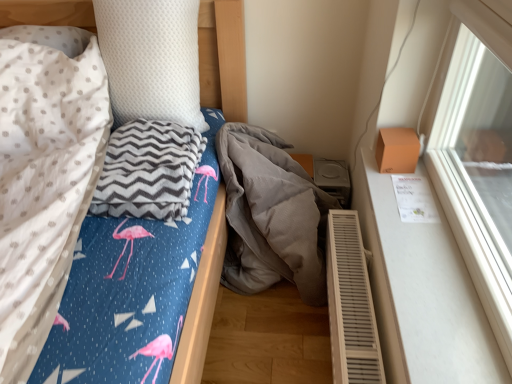
Identify the location of gray corduroy blanket at center, the 1th material viewed from the right. The height and width of the screenshot is (384, 512). (271, 215).

What do you see at coordinates (422, 291) in the screenshot? I see `white matte window sill at right` at bounding box center [422, 291].

In order to face white matte window sill at right, should I rotate leftwards or rightwards?

A 20.139 degree turn to the right will do.

You are a GUI agent. You are given a task and a screenshot of the screen. Output one action in this format:
    pyautogui.click(x=<x>, y=<y>)
    Task: Click on the white plastic air conditioner at lower right
    
    Given the screenshot: What is the action you would take?
    pyautogui.click(x=351, y=304)

Locate an element on the screen. white dotted pillow at upper left is located at coordinates (151, 59).

What do you see at coordinates (148, 171) in the screenshot? This screenshot has width=512, height=384. I see `gray chevron blanket at left, which ranks as the 1th material in left-to-right order` at bounding box center [148, 171].

Identify the location of gray corduroy blanket at center, the 1th material viewed from the right. Image resolution: width=512 pixels, height=384 pixels. (271, 215).

Which object is wider, white dotted pillow at upper left or gray corduroy blanket at center, the 1th material viewed from the right?

gray corduroy blanket at center, the 1th material viewed from the right, is wider.

From the image's perspective, who appears lower, white dotted pillow at upper left or gray corduroy blanket at center, the 1th material viewed from the right?

gray corduroy blanket at center, the 1th material viewed from the right.

Is point (138, 16) positioned behind point (297, 265)?

No, it is in front of (297, 265).

Considering the relative positions of white matte window sill at right and white plastic air conditioner at lower right in the image provided, is white matte window sill at right in front of white plastic air conditioner at lower right?

Yes.

Are white matte window sill at right and white plastic air conditioner at lower right located far from each other?

No, white matte window sill at right is not far away from white plastic air conditioner at lower right.

Is white matte window sill at right wider or thinner than white plastic air conditioner at lower right?

Considering their sizes, white matte window sill at right looks broader than white plastic air conditioner at lower right.

Considering the sizes of white matte window sill at right and white plastic air conditioner at lower right in the image, is white matte window sill at right bigger or smaller than white plastic air conditioner at lower right?

white matte window sill at right is smaller than white plastic air conditioner at lower right.

Does gray chevron blanket at left, which is the 2th material from right to left, lie behind white dotted pillow at upper left?

No, the depth of gray chevron blanket at left, which is the 2th material from right to left, is less than that of white dotted pillow at upper left.

Consider the image. From a real-world perspective, is gray chevron blanket at left, which is the 2th material from right to left, positioned under white dotted pillow at upper left based on gravity?

Yes, from a real-world perspective, gray chevron blanket at left, which is the 2th material from right to left, is under white dotted pillow at upper left.

From the picture: Considering the sizes of gray chevron blanket at left, which ranks as the 1th material in left-to-right order, and white dotted pillow at upper left in the image, is gray chevron blanket at left, which ranks as the 1th material in left-to-right order, wider or thinner than white dotted pillow at upper left?

In the image, gray chevron blanket at left, which ranks as the 1th material in left-to-right order, appears to be wider than white dotted pillow at upper left.

Is gray chevron blanket at left, which ranks as the 1th material in left-to-right order, at the right side of white dotted pillow at upper left?

Correct, you'll find gray chevron blanket at left, which ranks as the 1th material in left-to-right order, to the right of white dotted pillow at upper left.

How many degrees apart are the facing directions of gray corduroy blanket at center, the 1th material viewed from the right, and white dotted pillow at upper left?

2.49 degrees.

Which object is more forward, gray corduroy blanket at center, which is counted as the 2th material, starting from the left, or white dotted pillow at upper left?

gray corduroy blanket at center, which is counted as the 2th material, starting from the left.

Is point (243, 215) more distant than point (147, 67)?

That is True.

Does gray corduroy blanket at center, the 1th material viewed from the right, contain white dotted pillow at upper left?

No, white dotted pillow at upper left is located outside of gray corduroy blanket at center, the 1th material viewed from the right.

From a real-world perspective, does white matte window sill at right stand above gray corduroy blanket at center, which is counted as the 2th material, starting from the left?

Yes, from a real-world perspective, white matte window sill at right is above gray corduroy blanket at center, which is counted as the 2th material, starting from the left.

Does white matte window sill at right appear on the left side of gray corduroy blanket at center, the 1th material viewed from the right?

In fact, white matte window sill at right is to the right of gray corduroy blanket at center, the 1th material viewed from the right.

Is gray corduroy blanket at center, the 1th material viewed from the right, located within white matte window sill at right?

No, gray corduroy blanket at center, the 1th material viewed from the right, is located outside of white matte window sill at right.

Locate an element on the screen. The image size is (512, 384). material located underneath the white matte window sill at right (from a real-world perspective) is located at coordinates (271, 215).

Does gray corduroy blanket at center, the 1th material viewed from the right, have a greater width compared to gray chevron blanket at left, which is the 2th material from right to left?

Yes, gray corduroy blanket at center, the 1th material viewed from the right, is wider than gray chevron blanket at left, which is the 2th material from right to left.

Can you confirm if gray corduroy blanket at center, the 1th material viewed from the right, is bigger than gray chevron blanket at left, which ranks as the 1th material in left-to-right order?

Indeed, gray corduroy blanket at center, the 1th material viewed from the right, has a larger size compared to gray chevron blanket at left, which ranks as the 1th material in left-to-right order.

Would you say gray corduroy blanket at center, the 1th material viewed from the right, is outside gray chevron blanket at left, which ranks as the 1th material in left-to-right order?

Absolutely, gray corduroy blanket at center, the 1th material viewed from the right, is external to gray chevron blanket at left, which ranks as the 1th material in left-to-right order.

Does gray chevron blanket at left, which is the 2th material from right to left, turn towards white matte window sill at right?

No, gray chevron blanket at left, which is the 2th material from right to left, is not turned towards white matte window sill at right.

Is gray chevron blanket at left, which is the 2th material from right to left, to the right of white matte window sill at right from the viewer's perspective?

Incorrect, gray chevron blanket at left, which is the 2th material from right to left, is not on the right side of white matte window sill at right.

From a real-world perspective, is gray chevron blanket at left, which ranks as the 1th material in left-to-right order, below white matte window sill at right?

No, from a real-world perspective, gray chevron blanket at left, which ranks as the 1th material in left-to-right order, is not under white matte window sill at right.

Who is shorter, gray chevron blanket at left, which is the 2th material from right to left, or white matte window sill at right?

Standing shorter between the two is white matte window sill at right.

Identify the location of pillow lying behind the gray corduroy blanket at center, which is counted as the 2th material, starting from the left. (151, 59).

The image size is (512, 384). Identify the location of window sill lying on the right of white plastic air conditioner at lower right. (422, 291).

Considering their positions, is white plastic air conditioner at lower right positioned further to white matte window sill at right than gray corduroy blanket at center, the 1th material viewed from the right?

gray corduroy blanket at center, the 1th material viewed from the right, is further to white matte window sill at right.

Which object lies nearer to the anchor point white dotted pillow at upper left, white plastic air conditioner at lower right or gray chevron blanket at left, which ranks as the 1th material in left-to-right order?

gray chevron blanket at left, which ranks as the 1th material in left-to-right order, lies closer to white dotted pillow at upper left than the other object.

Based on the photo, estimate the real-world distances between objects in this image. Which object is closer to white matte window sill at right, white plastic air conditioner at lower right or white dotted pillow at upper left?

white plastic air conditioner at lower right.

From the image, which object appears to be farther from white matte window sill at right, gray corduroy blanket at center, which is counted as the 2th material, starting from the left, or white dotted pillow at upper left?

white dotted pillow at upper left is further to white matte window sill at right.

Based on their spatial positions, is white matte window sill at right or white dotted pillow at upper left further from white plastic air conditioner at lower right?

white dotted pillow at upper left is further to white plastic air conditioner at lower right.

Based on their spatial positions, is gray chevron blanket at left, which is the 2th material from right to left, or white matte window sill at right closer to gray corduroy blanket at center, the 1th material viewed from the right?

The object closer to gray corduroy blanket at center, the 1th material viewed from the right, is gray chevron blanket at left, which is the 2th material from right to left.

From the picture: Looking at the image, which one is located further to white plastic air conditioner at lower right, white matte window sill at right or gray chevron blanket at left, which is the 2th material from right to left?

gray chevron blanket at left, which is the 2th material from right to left.

Considering their positions, is white plastic air conditioner at lower right positioned closer to gray chevron blanket at left, which ranks as the 1th material in left-to-right order, than white matte window sill at right?

white plastic air conditioner at lower right.

Where is `material situated between white dotted pillow at upper left and gray corduroy blanket at center, the 1th material viewed from the right, from left to right`? The height and width of the screenshot is (384, 512). material situated between white dotted pillow at upper left and gray corduroy blanket at center, the 1th material viewed from the right, from left to right is located at coordinates (148, 171).

Find the location of a particular element. air conditioner between white matte window sill at right and gray corduroy blanket at center, which is counted as the 2th material, starting from the left, from front to back is located at coordinates (351, 304).

Identify the location of material between gray chevron blanket at left, which ranks as the 1th material in left-to-right order, and white plastic air conditioner at lower right from left to right. (271, 215).

Locate an element on the screen. air conditioner between gray chevron blanket at left, which ranks as the 1th material in left-to-right order, and white matte window sill at right, in the horizontal direction is located at coordinates (351, 304).